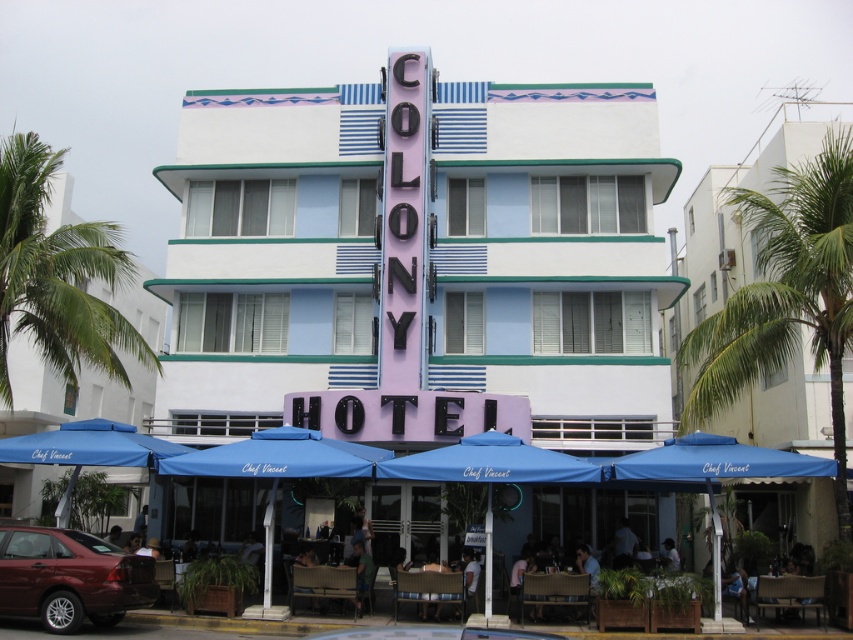
Who is more distant from viewer, (94,257) or (669,458)?

The point (94,257) is behind.

Where is `green leafy palm tree at left`? green leafy palm tree at left is located at coordinates (57, 275).

This screenshot has height=640, width=853. Find the location of `green leafy palm tree at left`. green leafy palm tree at left is located at coordinates pos(57,275).

Is green leafy palm tree at left shorter than blue fabric umbrella at lower center?

In fact, green leafy palm tree at left may be taller than blue fabric umbrella at lower center.

Which is above, green leafy palm tree at left or blue fabric umbrella at lower center?

green leafy palm tree at left is higher up.

Locate an element on the screen. The height and width of the screenshot is (640, 853). green leafy palm tree at left is located at coordinates (57, 275).

Is pastel purple sign at center below blue fabric umbrella at lower center?

Incorrect, pastel purple sign at center is not positioned below blue fabric umbrella at lower center.

Is point (602, 92) farther from viewer compared to point (173, 472)?

That is True.

Which is behind, point (361, 182) or point (291, 436)?

The point (361, 182) is behind.

Image resolution: width=853 pixels, height=640 pixels. Identify the location of pastel purple sign at center. (419, 264).